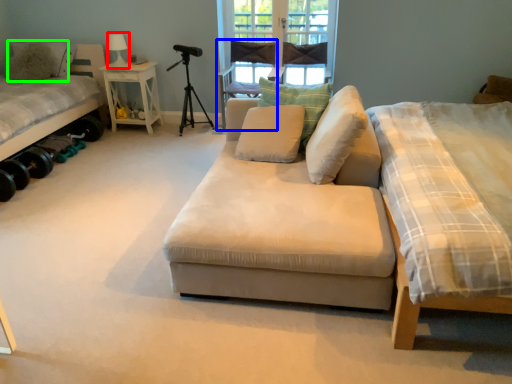
Question: Which object is the closest to the table lamp (highlighted by a red box)? Choose among these: armchair (highlighted by a blue box) or pillow (highlighted by a green box).

Choices:
 (A) armchair
 (B) pillow

Answer: (B)